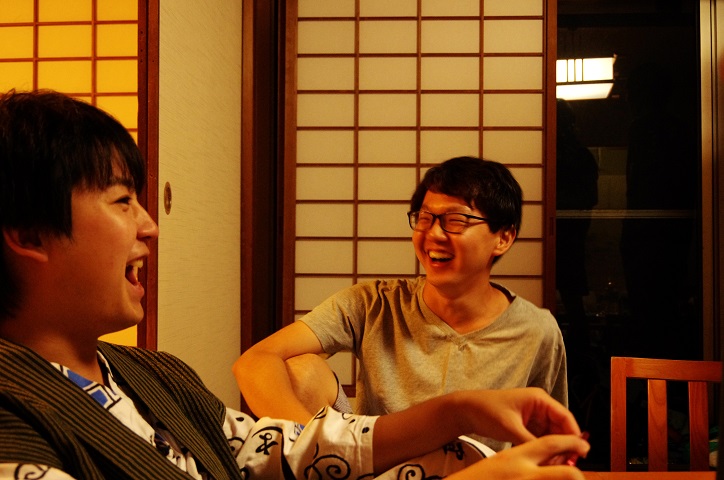
I want to click on door, so click(x=552, y=132).